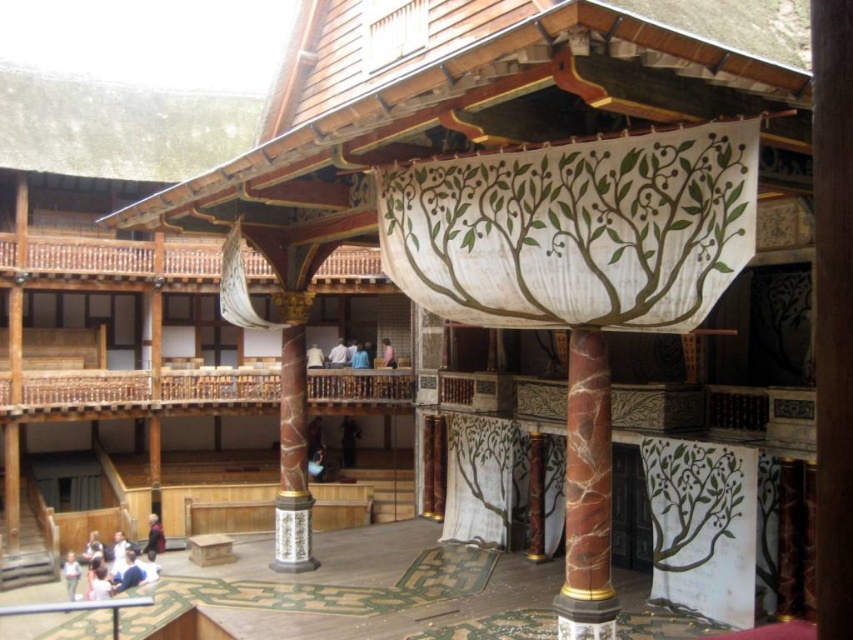
Question: Which of the following is the closest to the observer?

Choices:
 (A) dark brown leather jacket at center
 (B) light blue fabric at lower left

Answer: (B)

Question: Estimate the real-world distances between objects in this image. Which object is closer to the light blue shirt at lower left?

Choices:
 (A) pink fabric at upper center
 (B) dark brown leather jacket at center
 (C) light blue fabric at upper center
 (D) light blue fabric at lower left

Answer: (D)

Question: Is the position of marble column at center more distant than that of light blue fabric at upper center?

Choices:
 (A) yes
 (B) no

Answer: (B)

Question: Considering the relative positions of light blue fabric at upper center and pink fabric at upper center in the image provided, where is light blue fabric at upper center located with respect to pink fabric at upper center?

Choices:
 (A) left
 (B) right

Answer: (A)

Question: Does dark brown leather jacket at center have a lesser width compared to light blue fabric at upper center?

Choices:
 (A) yes
 (B) no

Answer: (B)

Question: Which object appears closest to the camera in this image?

Choices:
 (A) white fabric at upper center
 (B) light blue fabric at lower left
 (C) pink fabric at upper center

Answer: (B)